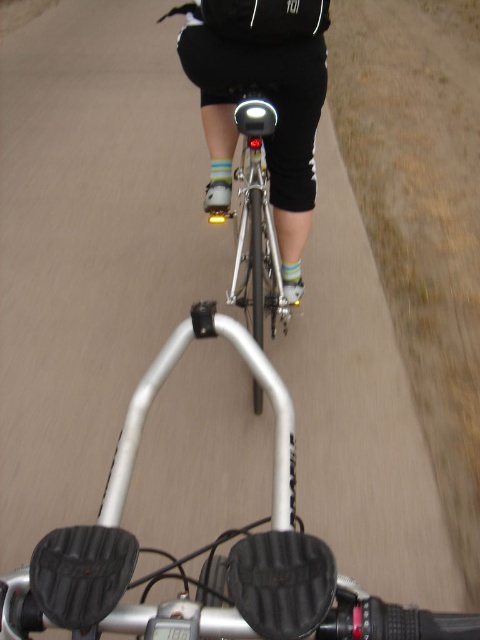
Question: Which object is farther from the camera taking this photo?

Choices:
 (A) black matte shorts at center
 (B) shiny silver bicycle at center

Answer: (B)

Question: Which of the following is the closest to the observer?

Choices:
 (A) (256, 154)
 (B) (277, 61)

Answer: (B)

Question: Is black matte shorts at center smaller than shiny silver bicycle at center?

Choices:
 (A) no
 (B) yes

Answer: (A)

Question: Can you confirm if black matte shorts at center is bigger than shiny silver bicycle at center?

Choices:
 (A) no
 (B) yes

Answer: (B)

Question: Does black matte shorts at center have a larger size compared to shiny silver bicycle at center?

Choices:
 (A) no
 (B) yes

Answer: (B)